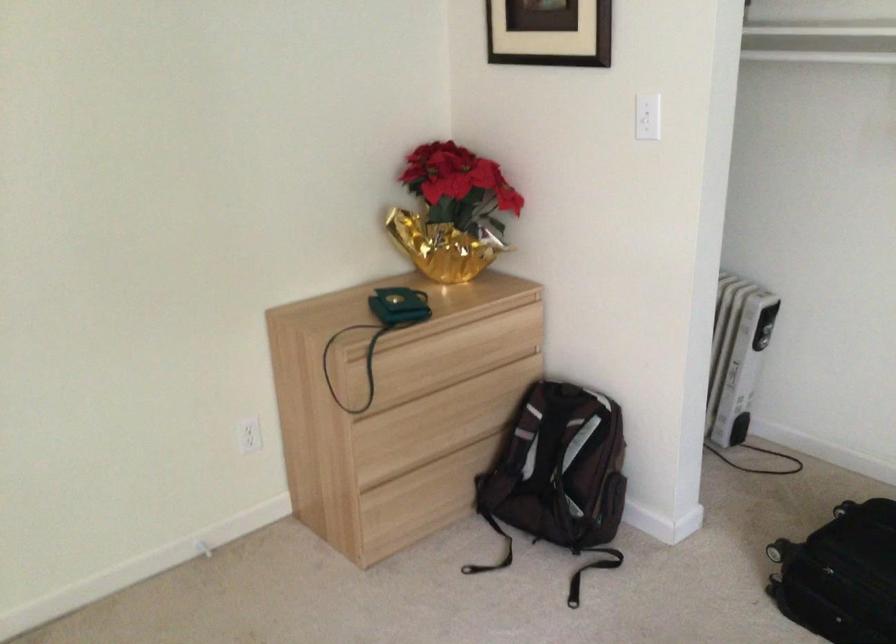
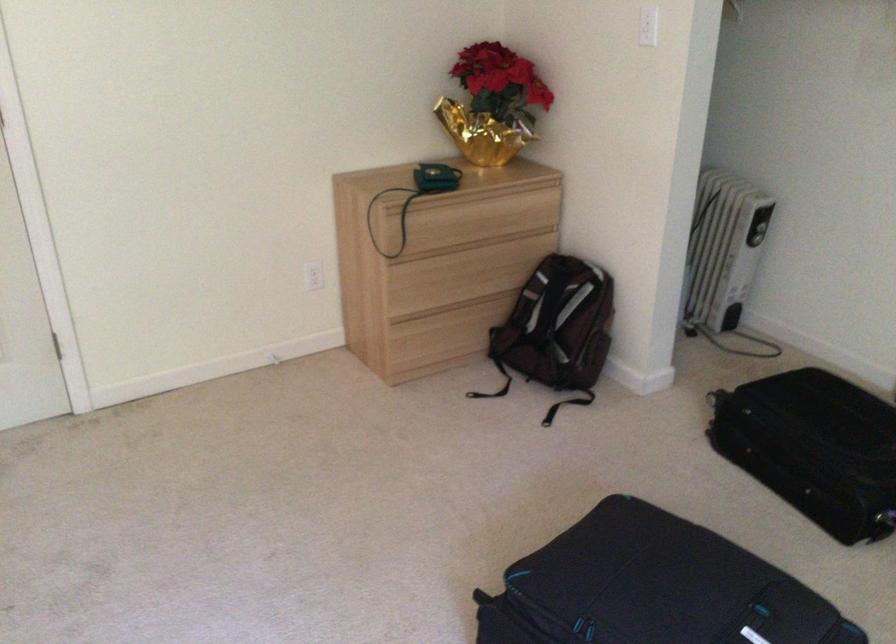
Find the pixel in the second image that matches point (650, 115) in the first image.

(648, 26)